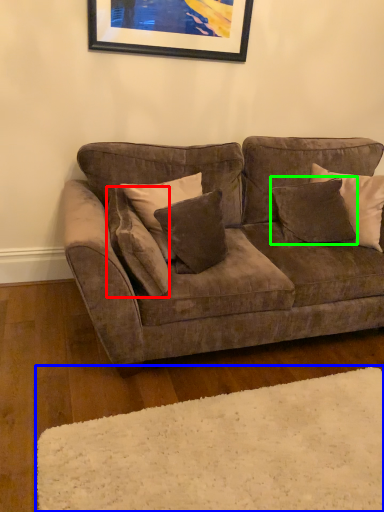
Question: Estimate the real-world distances between objects in this image. Which object is closer to pillow (highlighted by a red box), plain (highlighted by a blue box) or pillow (highlighted by a green box)?

Choices:
 (A) plain
 (B) pillow

Answer: (A)